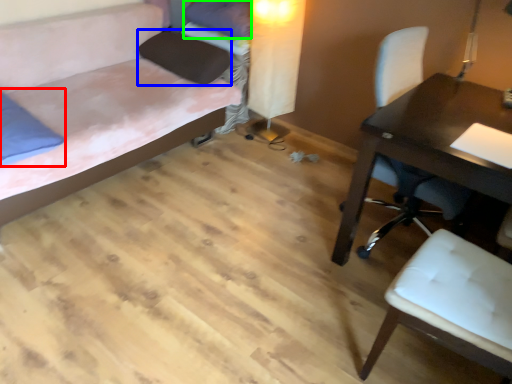
Question: Based on their relative distances, which object is farther from pillow (highlighted by a red box)? Choose from pillow (highlighted by a blue box) and pillow (highlighted by a green box).

Choices:
 (A) pillow
 (B) pillow

Answer: (B)